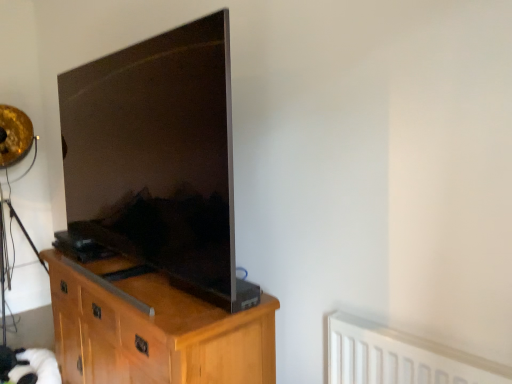
Find the location of a particular element. The image size is (512, 384). blank area beneath matte black tv at left (from a real-world perspective) is located at coordinates (134, 274).